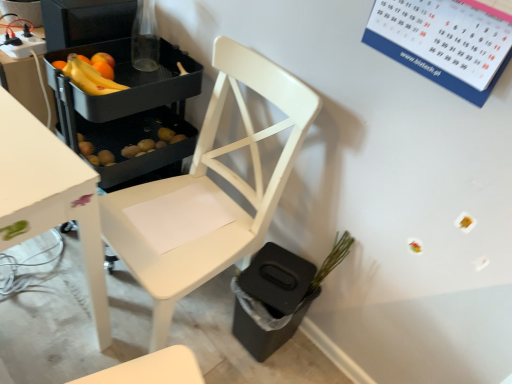
Describe the element at coordinates (86, 21) in the screenshot. The width and height of the screenshot is (512, 384). I see `matte black tray at upper left` at that location.

Find the location of a particular element. yellow matte bananas at upper left is located at coordinates (89, 77).

Identify the location of matte black tray at upper left. (86, 21).

Consider the image. Which of these two, yellow matte bananas at upper left or matte black tray at upper left, is wider?

matte black tray at upper left.

Is yellow matte bananas at upper left aimed at matte black tray at upper left?

No, yellow matte bananas at upper left does not turn towards matte black tray at upper left.

Is yellow matte bananas at upper left next to matte black tray at upper left?

No, yellow matte bananas at upper left is not with matte black tray at upper left.

From the picture: Can you tell me how much white wood chair at center and matte black tray at upper left differ in facing direction?

0.0568 degrees separate the facing orientations of white wood chair at center and matte black tray at upper left.

Does white wood chair at center come in front of matte black tray at upper left?

Yes, the depth of white wood chair at center is less than that of matte black tray at upper left.

Does white wood chair at center have a smaller size compared to matte black tray at upper left?

Incorrect, white wood chair at center is not smaller in size than matte black tray at upper left.

Can you see yellow matte bananas at upper left touching green matte plant at lower right?

No, yellow matte bananas at upper left is not beside green matte plant at lower right.

In the scene shown: Considering the sizes of objects yellow matte bananas at upper left and green matte plant at lower right in the image provided, who is smaller, yellow matte bananas at upper left or green matte plant at lower right?

Smaller between the two is green matte plant at lower right.

Which object is more forward, yellow matte bananas at upper left or green matte plant at lower right?

yellow matte bananas at upper left is closer to the camera.

From the picture: Between white wood chair at center and green matte plant at lower right, which one has less height?

green matte plant at lower right.

From the image's perspective, is white wood chair at center located beneath green matte plant at lower right?

No.

Which object is positioned more to the right, white wood chair at center or green matte plant at lower right?

Positioned to the right is green matte plant at lower right.

Is matte black tray at upper left located outside yellow matte bananas at upper left?

matte black tray at upper left is positioned outside yellow matte bananas at upper left.

Would you say matte black tray at upper left is a long distance from yellow matte bananas at upper left?

That's not correct — matte black tray at upper left is a little close to yellow matte bananas at upper left.

From a real-world perspective, who is located lower, matte black tray at upper left or yellow matte bananas at upper left?

matte black tray at upper left.

Is matte black tray at upper left bigger or smaller than yellow matte bananas at upper left?

Considering their sizes, matte black tray at upper left takes up more space than yellow matte bananas at upper left.

Considering the relative sizes of green matte plant at lower right and white wood chair at center in the image provided, is green matte plant at lower right bigger than white wood chair at center?

No, green matte plant at lower right is not bigger than white wood chair at center.

From the image's perspective, is green matte plant at lower right located above or below white wood chair at center?

Based on their image positions, green matte plant at lower right is located beneath white wood chair at center.

Which is farther from the camera, (322, 274) or (189, 184)?

→ The point (189, 184) is behind.

From a real-world perspective, is green matte plant at lower right positioned over white wood chair at center based on gravity?

No.

Consider the image. Considering the relative sizes of white wood chair at center and yellow matte bananas at upper left in the image provided, is white wood chair at center taller than yellow matte bananas at upper left?

Correct, white wood chair at center is much taller as yellow matte bananas at upper left.

From the image's perspective, would you say white wood chair at center is shown under yellow matte bananas at upper left?

Indeed, from the image's perspective, white wood chair at center is shown beneath yellow matte bananas at upper left.

In the image, is white wood chair at center on the left side or the right side of yellow matte bananas at upper left?

white wood chair at center is positioned on yellow matte bananas at upper left's right side.

Where is `banana above the matte black tray at upper left (from a real-world perspective)`? The width and height of the screenshot is (512, 384). banana above the matte black tray at upper left (from a real-world perspective) is located at coordinates (89, 77).

Locate an element on the screen. appliance that appears above the white wood chair at center (from the image's perspective) is located at coordinates (86, 21).

When comparing their distances from white wood chair at center, does matte black tray at upper left or green matte plant at lower right seem closer?

Among the two, green matte plant at lower right is located nearer to white wood chair at center.

Estimate the real-world distances between objects in this image. Which object is further from green matte plant at lower right, yellow matte bananas at upper left or white wood chair at center?

yellow matte bananas at upper left lies further to green matte plant at lower right than the other object.

Considering their positions, is green matte plant at lower right positioned closer to white wood chair at center than matte black tray at upper left?

green matte plant at lower right lies closer to white wood chair at center than the other object.

Based on their spatial positions, is matte black tray at upper left or white wood chair at center closer to green matte plant at lower right?

Based on the image, white wood chair at center appears to be nearer to green matte plant at lower right.

Based on their spatial positions, is green matte plant at lower right or matte black tray at upper left further from yellow matte bananas at upper left?

green matte plant at lower right is further to yellow matte bananas at upper left.

When comparing their distances from matte black tray at upper left, does green matte plant at lower right or white wood chair at center seem closer?

The object closer to matte black tray at upper left is white wood chair at center.

Estimate the real-world distances between objects in this image. Which object is further from yellow matte bananas at upper left, matte black tray at upper left or white wood chair at center?

The object further to yellow matte bananas at upper left is white wood chair at center.

Estimate the real-world distances between objects in this image. Which object is closer to matte black tray at upper left, green matte plant at lower right or yellow matte bananas at upper left?

Based on the image, yellow matte bananas at upper left appears to be nearer to matte black tray at upper left.

At what (x,y) coordinates should I click in order to perform the action: click on banana between matte black tray at upper left and green matte plant at lower right in the horizontal direction. Please return your answer as a coordinate pair (x, y). The image size is (512, 384). Looking at the image, I should click on (89, 77).

The image size is (512, 384). In order to click on chair between yellow matte bananas at upper left and green matte plant at lower right in this screenshot , I will do `click(207, 192)`.

Locate an element on the screen. This screenshot has width=512, height=384. banana between matte black tray at upper left and white wood chair at center in the up-down direction is located at coordinates (89, 77).

The image size is (512, 384). What are the coordinates of `chair that lies between matte black tray at upper left and green matte plant at lower right from top to bottom` in the screenshot? It's located at (207, 192).